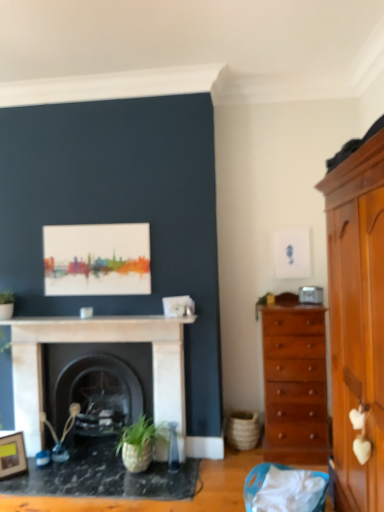
Question: From a real-world perspective, is white marble fireplace at center, which ranks as the second fireplace in back-to-front order, physically above green matte plant at upper right?

Choices:
 (A) yes
 (B) no

Answer: (B)

Question: Does white marble fireplace at center, positioned as the first fireplace in front-to-back order, come behind green matte plant at upper right?

Choices:
 (A) no
 (B) yes

Answer: (A)

Question: Considering the relative sizes of white marble fireplace at center, which ranks as the second fireplace in back-to-front order, and green matte plant at upper right in the image provided, is white marble fireplace at center, which ranks as the second fireplace in back-to-front order, thinner than green matte plant at upper right?

Choices:
 (A) no
 (B) yes

Answer: (B)

Question: From the image's perspective, does white marble fireplace at center, positioned as the first fireplace in front-to-back order, appear lower than green matte plant at upper right?

Choices:
 (A) no
 (B) yes

Answer: (B)

Question: Does white marble fireplace at center, which ranks as the second fireplace in back-to-front order, turn towards green matte plant at upper right?

Choices:
 (A) no
 (B) yes

Answer: (A)

Question: Does white marble fireplace at center, which ranks as the second fireplace in back-to-front order, have a smaller size compared to green matte plant at upper right?

Choices:
 (A) yes
 (B) no

Answer: (B)

Question: Does wooden picture frame at lower left have a lesser height compared to black marble fireplace at center, the first fireplace from the back?

Choices:
 (A) no
 (B) yes

Answer: (B)

Question: From the image's perspective, is wooden picture frame at lower left on top of black marble fireplace at center, acting as the second fireplace starting from the front?

Choices:
 (A) no
 (B) yes

Answer: (A)

Question: Is wooden picture frame at lower left surrounding black marble fireplace at center, acting as the second fireplace starting from the front?

Choices:
 (A) no
 (B) yes

Answer: (A)

Question: Is wooden picture frame at lower left oriented away from black marble fireplace at center, the first fireplace from the back?

Choices:
 (A) yes
 (B) no

Answer: (B)

Question: Is wooden picture frame at lower left closer to camera compared to black marble fireplace at center, acting as the second fireplace starting from the front?

Choices:
 (A) no
 (B) yes

Answer: (B)

Question: Considering the relative positions of wooden picture frame at lower left and black marble fireplace at center, the first fireplace from the back, in the image provided, is wooden picture frame at lower left to the left of black marble fireplace at center, the first fireplace from the back, from the viewer's perspective?

Choices:
 (A) yes
 (B) no

Answer: (A)

Question: From the image's perspective, does white marble fireplace at center appear lower than light brown wooden cabinet at right?

Choices:
 (A) yes
 (B) no

Answer: (B)